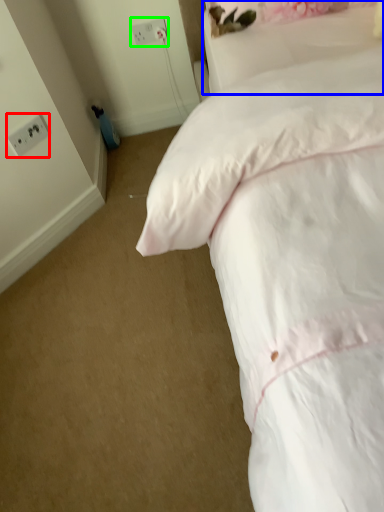
Question: Considering the real-world distances, which object is farthest from electric outlet (highlighted by a red box)? pillow (highlighted by a blue box) or electric outlet (highlighted by a green box)?

Choices:
 (A) pillow
 (B) electric outlet

Answer: (A)